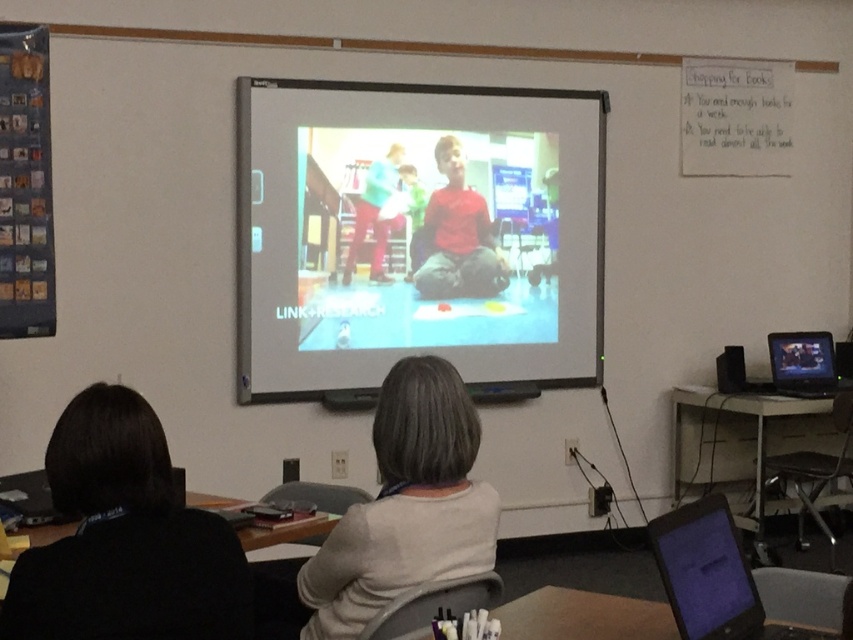
Question: Which point is closer to the camera?

Choices:
 (A) white matte sweater at center
 (B) black glossy laptop at lower right

Answer: (B)

Question: Which is nearer to the black glossy laptop at right?

Choices:
 (A) black glossy laptop at lower right
 (B) white matte sweater at center
 (C) matte projector screen at center
 (D) green fabric shirt at center

Answer: (C)

Question: Does white matte sweater at center have a smaller size compared to black glossy laptop at right?

Choices:
 (A) yes
 (B) no

Answer: (B)

Question: Which object is the closest to the black glossy laptop at right?

Choices:
 (A) white matte sweater at center
 (B) black glossy laptop at lower right
 (C) matte projector screen at center
 (D) green fabric shirt at center

Answer: (C)

Question: Considering the relative positions of white matte sweater at center and black glossy laptop at right in the image provided, where is white matte sweater at center located with respect to black glossy laptop at right?

Choices:
 (A) below
 (B) above

Answer: (A)

Question: Does white matte sweater at center have a greater width compared to black glossy laptop at lower right?

Choices:
 (A) yes
 (B) no

Answer: (B)